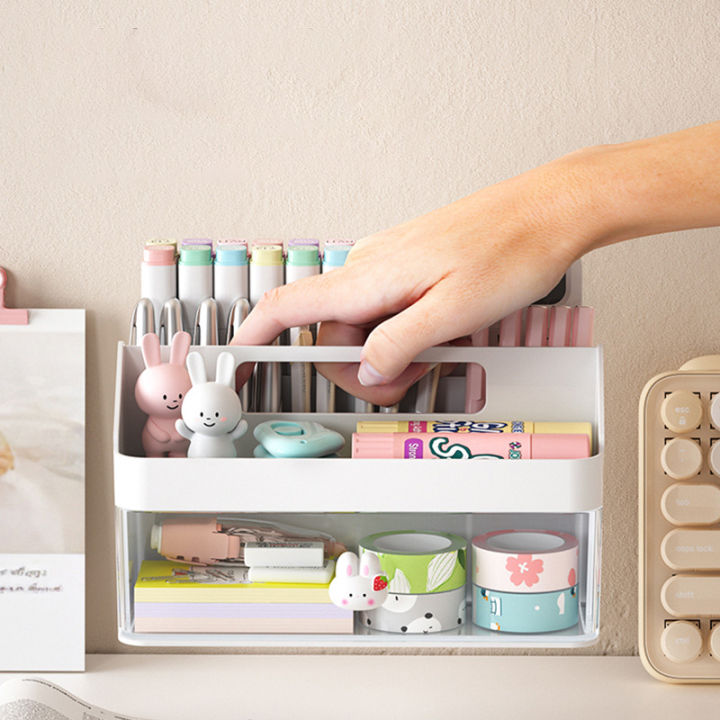
This screenshot has height=720, width=720. I want to click on visible and partly visible white bottles on top shelf, so click(x=158, y=279), click(x=192, y=281), click(x=227, y=279), click(x=263, y=282), click(x=302, y=271), click(x=330, y=266).